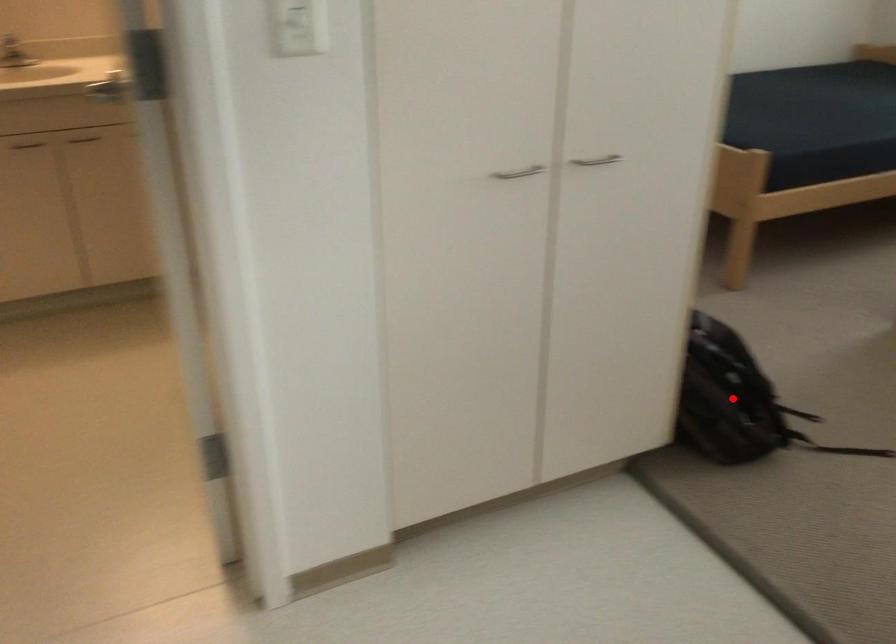
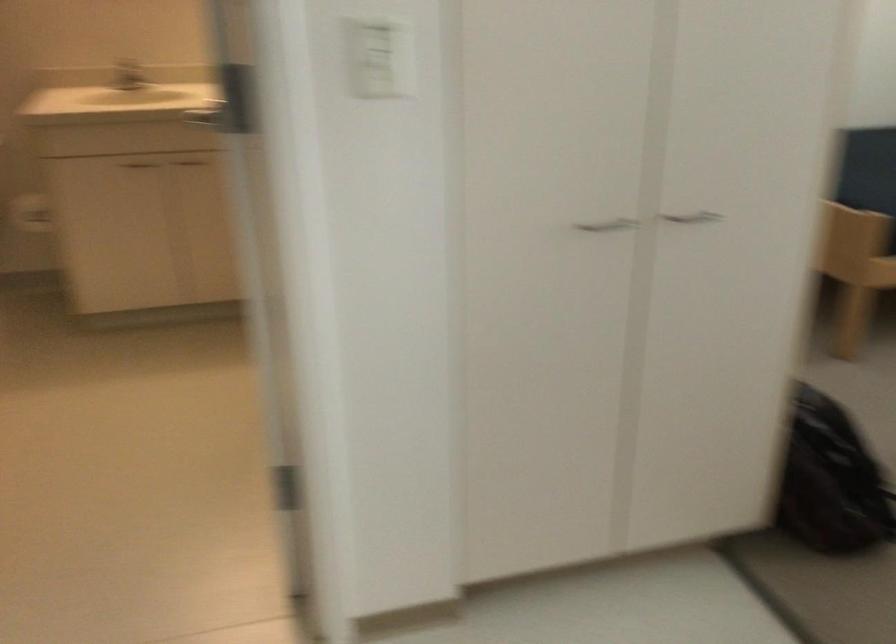
Question: I am providing you with two images of the same scene from different viewpoints. Image1 has a red point marked. In image2, the corresponding 3D location appears at what relative position? Reply with the corresponding letter.

Choices:
 (A) Closer
 (B) Farther

Answer: (A)